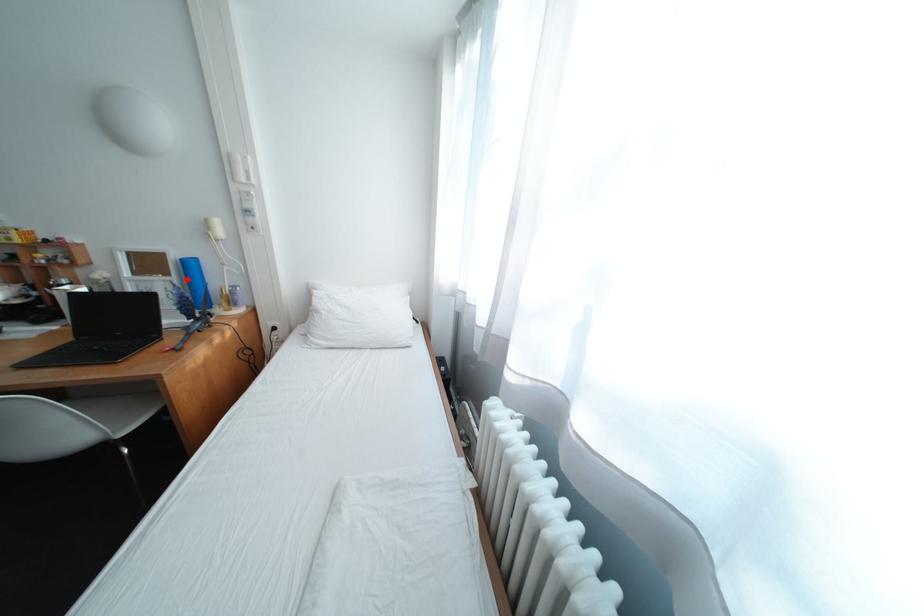
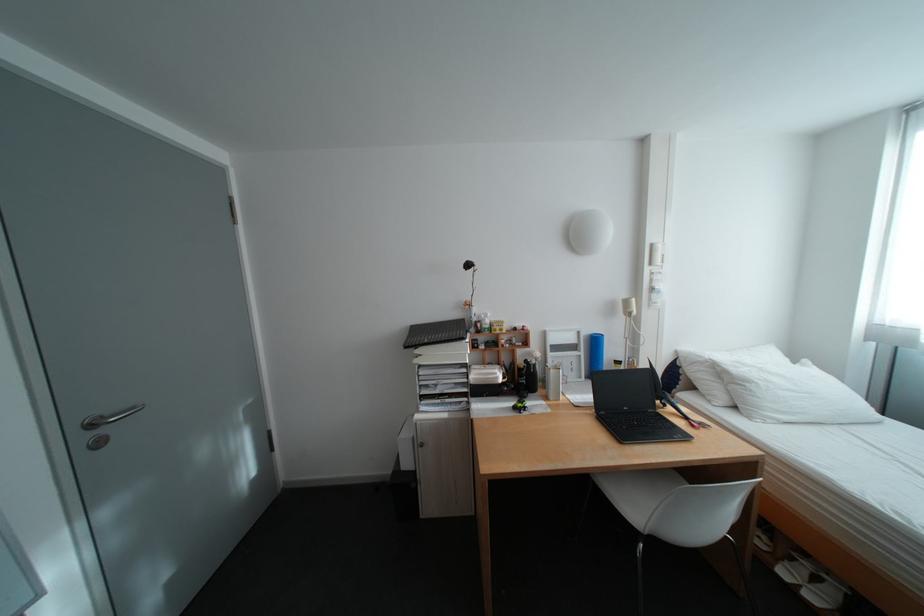
Question: I am providing you with two images of the same scene from different viewpoints. Image1 has a red point marked. In image2, the corresponding 3D location appears at what relative position? Reply with the corresponding letter.

Choices:
 (A) Closer
 (B) Farther

Answer: (B)